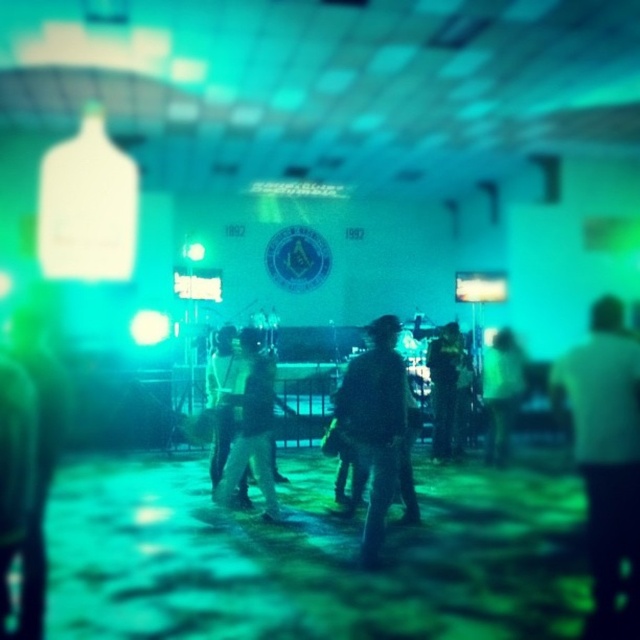
Question: Is dark denim jacket at center positioned at the back of green fabric jacket at center?

Choices:
 (A) yes
 (B) no

Answer: (B)

Question: Which of the following is the farthest from the observer?

Choices:
 (A) (240, 433)
 (B) (499, 352)
 (C) (234, 384)

Answer: (B)

Question: Can you confirm if denim jacket at center is positioned to the left of green fabric jacket at center?

Choices:
 (A) yes
 (B) no

Answer: (A)

Question: Does white matte shirt at right appear on the left side of denim jacket at center?

Choices:
 (A) no
 (B) yes

Answer: (A)

Question: Estimate the real-world distances between objects in this image. Which object is closer to the dark fabric jacket at center?

Choices:
 (A) dark denim jacket at center
 (B) denim pants at center
 (C) green fabric jacket at center
 (D) matte black jacket at left

Answer: (C)

Question: Which point is closer to the camera?

Choices:
 (A) (444, 371)
 (B) (625, 435)

Answer: (B)